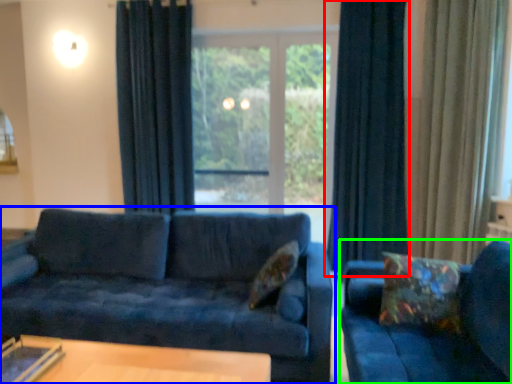
Question: Which is farther away from curtain (highlighted by a red box)? studio couch (highlighted by a blue box) or studio couch (highlighted by a green box)?

Choices:
 (A) studio couch
 (B) studio couch

Answer: (B)